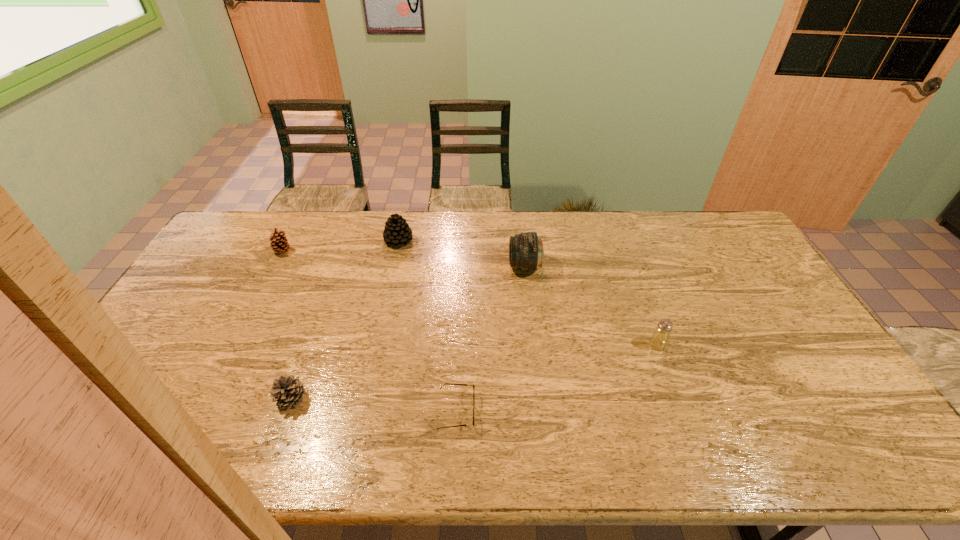
I want to click on vacant space located at the front element of the telephoto lens, so [395, 267].

The width and height of the screenshot is (960, 540). Find the location of `free spot located at the front element of the telephoto lens`. free spot located at the front element of the telephoto lens is located at coordinates click(450, 267).

The width and height of the screenshot is (960, 540). I want to click on free point located 0.050m at the front element of the telephoto lens, so click(x=494, y=267).

Locate an element on the screen. This screenshot has height=540, width=960. vacant space located at the narrow end of the third object from left to right is located at coordinates (432, 241).

The height and width of the screenshot is (540, 960). I want to click on vacant area situated on the back of the second tallest pinecone, so click(x=291, y=235).

This screenshot has width=960, height=540. In order to click on free space located on the left of the saltshaker in this screenshot , I will do `click(551, 345)`.

Image resolution: width=960 pixels, height=540 pixels. Find the location of `free spot located 0.310m on the left of the shortest pinecone`. free spot located 0.310m on the left of the shortest pinecone is located at coordinates click(156, 399).

This screenshot has width=960, height=540. In order to click on vacant region located 0.390m on the front-facing side of the shortest object in this screenshot , I will do `click(630, 411)`.

This screenshot has height=540, width=960. What are the coordinates of `object that is positioned at the near edge` in the screenshot? It's located at (444, 384).

Locate an element on the screen. The width and height of the screenshot is (960, 540). free space at the far edge of the desktop is located at coordinates (501, 241).